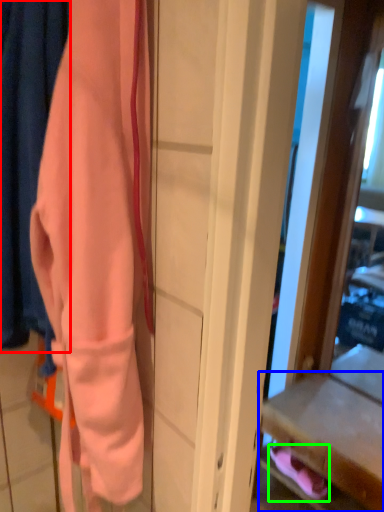
Question: Which object is the farthest from curtain (highlighted by a red box)? Choose among these: drawer (highlighted by a blue box) or footwear (highlighted by a green box).

Choices:
 (A) drawer
 (B) footwear

Answer: (B)